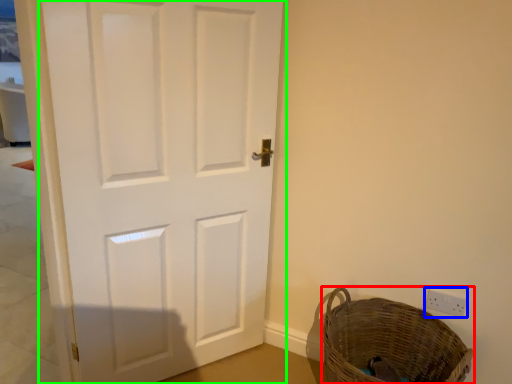
Question: Based on their relative distances, which object is nearer to basket (highlighted by a red box)? Choose from electric outlet (highlighted by a blue box) and door (highlighted by a green box).

Choices:
 (A) electric outlet
 (B) door

Answer: (A)